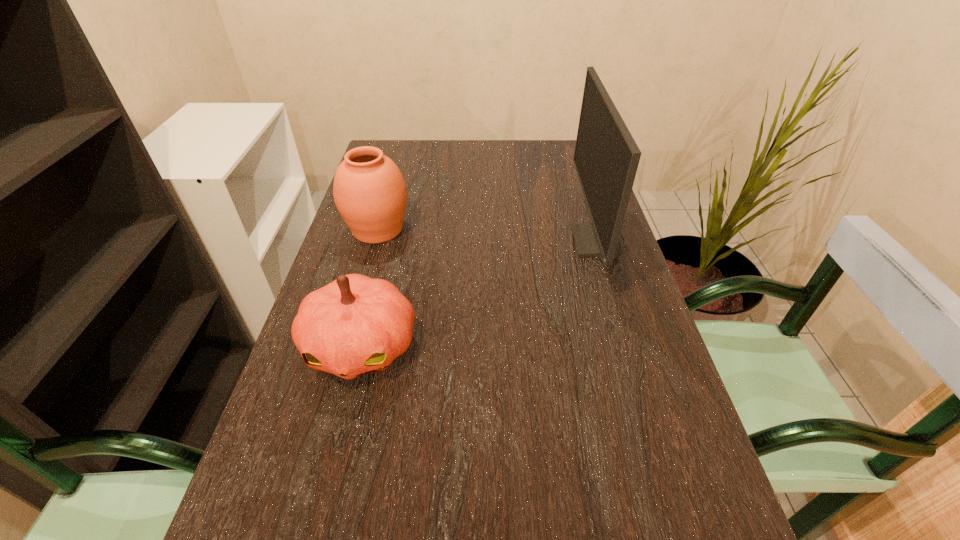
Locate an element on the screen. This screenshot has width=960, height=540. pumpkin present at the left edge is located at coordinates (355, 325).

The height and width of the screenshot is (540, 960). I want to click on object present at the right edge, so click(x=606, y=158).

Where is `vacant area at the far edge`? The image size is (960, 540). vacant area at the far edge is located at coordinates (448, 141).

You are a GUI agent. You are given a task and a screenshot of the screen. Output one action in this format:
    pyautogui.click(x=<x>, y=<y>)
    Task: Click on the vacant space at the left edge of the desktop
    
    Given the screenshot: What is the action you would take?
    pos(328,537)

Where is `vacant area at the right edge`? vacant area at the right edge is located at coordinates (551, 189).

You are a GUI agent. You are given a task and a screenshot of the screen. Output one action in this format:
    pyautogui.click(x=<x>, y=<y>)
    Task: Click on the free space between the tallest object and the urn
    The height and width of the screenshot is (540, 960).
    Given the screenshot: What is the action you would take?
    pyautogui.click(x=487, y=235)

I want to click on the closest object to the urn, so click(355, 325).

Locate an element on the screen. This screenshot has width=960, height=540. object that can be found as the closest to the pumpkin is located at coordinates (369, 190).